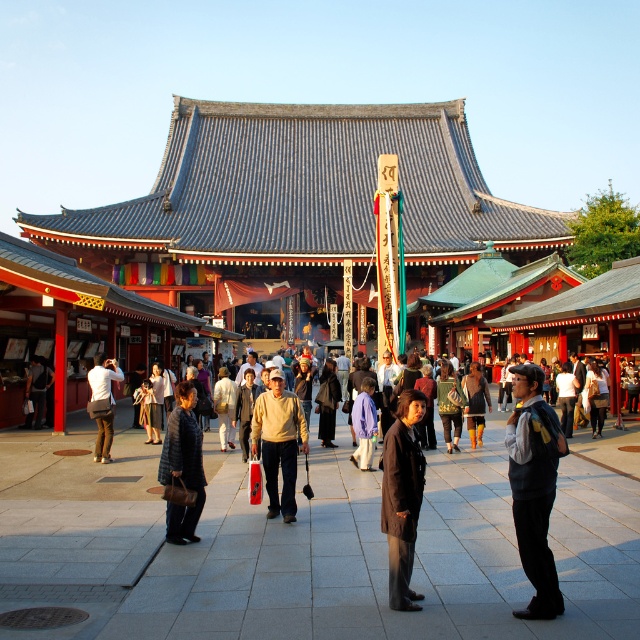
Is dark gray fabric coat at center to the right of brown leather jacket at center from the viewer's perspective?

In fact, dark gray fabric coat at center is to the left of brown leather jacket at center.

Is point (420, 460) closer to camera compared to point (480, 429)?

Yes, it is.

Locate an element on the screen. The image size is (640, 640). dark gray fabric coat at center is located at coordinates (403, 497).

Looking at this image, which of these two, dark gray fabric coat at center or matte black jacket at center, stands taller?

dark gray fabric coat at center

Where is `dark gray fabric coat at center`? The image size is (640, 640). dark gray fabric coat at center is located at coordinates (403, 497).

Can you confirm if dark gray fabric coat at center is taller than light brown sweater at center?

Yes, dark gray fabric coat at center is taller than light brown sweater at center.

Does point (401, 461) come in front of point (294, 506)?

Yes, it is in front of point (294, 506).

Where is `dark gray fabric coat at center`? The width and height of the screenshot is (640, 640). dark gray fabric coat at center is located at coordinates (403, 497).